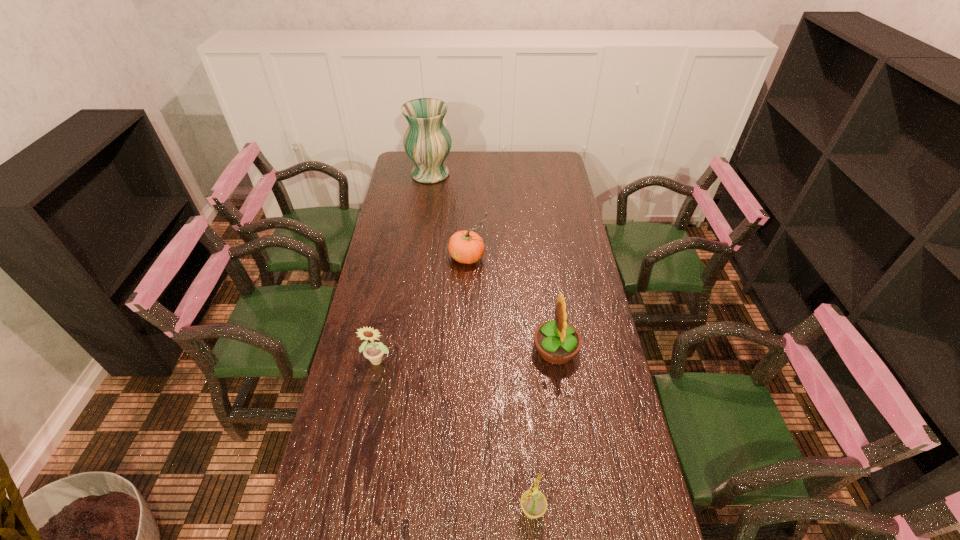
In order to click on free region located on the face of the tallest sunflower in this screenshot , I will do `click(492, 350)`.

The width and height of the screenshot is (960, 540). Identify the location of vacant space situated on the face of the tallest sunflower. (438, 350).

In order to click on free point located on the face of the tallest sunflower in this screenshot , I will do `click(505, 350)`.

The height and width of the screenshot is (540, 960). In order to click on vacant space located 0.190m on the left of the fourth nearest object in this screenshot , I will do click(x=401, y=256).

Where is `vacant space located 0.100m on the front-facing side of the leftmost sunflower`? vacant space located 0.100m on the front-facing side of the leftmost sunflower is located at coordinates (372, 400).

This screenshot has height=540, width=960. I want to click on free space located on the face of the nearest sunflower, so click(434, 510).

The height and width of the screenshot is (540, 960). In order to click on free space located 0.060m on the face of the nearest sunflower in this screenshot , I will do `click(493, 510)`.

Find the location of `vacant space located 0.360m on the face of the nearest sunflower`. vacant space located 0.360m on the face of the nearest sunflower is located at coordinates (373, 510).

Locate an element on the screen. The width and height of the screenshot is (960, 540). object situated at the far edge is located at coordinates (427, 142).

You are a GUI agent. You are given a task and a screenshot of the screen. Output one action in this format:
    pyautogui.click(x=<x>, y=<y>)
    Task: Click on the vase that is at the left edge
    
    Given the screenshot: What is the action you would take?
    (427, 142)